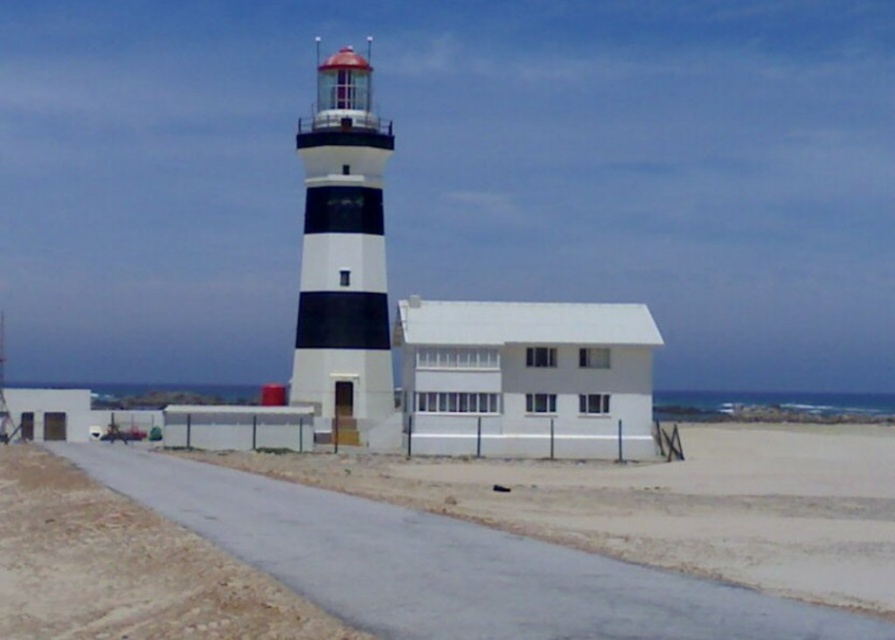
Is sandy beach at lower center taller than brown gravel at lower center?

No.

Who is shorter, sandy beach at lower center or brown gravel at lower center?

sandy beach at lower center

In the scene shown: Measure the distance between point (479, 538) and camera.

49.24 feet

The width and height of the screenshot is (895, 640). In order to click on sandy beach at lower center in this screenshot , I will do `click(320, 566)`.

Is brown gravel at lower center further to camera compared to black and white striped lighthouse at center?

No, it is in front of black and white striped lighthouse at center.

Who is shorter, brown gravel at lower center or black and white striped lighthouse at center?

With less height is brown gravel at lower center.

Is point (293, 634) less distant than point (354, 88)?

Yes, it is in front of point (354, 88).

This screenshot has width=895, height=640. What are the coordinates of `brown gravel at lower center` in the screenshot? It's located at coord(125,568).

Which is in front, point (241, 477) or point (310, 252)?

Point (241, 477) is in front.

Who is taller, sandy beach at lower center or black and white striped lighthouse at center?

black and white striped lighthouse at center

Who is more distant from viewer, (78, 483) or (351, 138)?

The point (351, 138) is behind.

Identify the location of sandy beach at lower center. This screenshot has height=640, width=895. (320, 566).